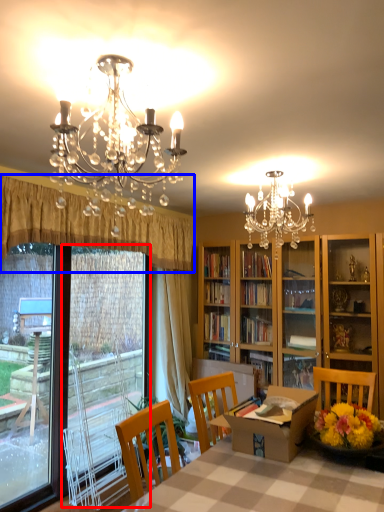
Question: Which of the following is the farthest to the observer, screen door (highlighted by a red box) or curtain (highlighted by a blue box)?

Choices:
 (A) screen door
 (B) curtain

Answer: (A)